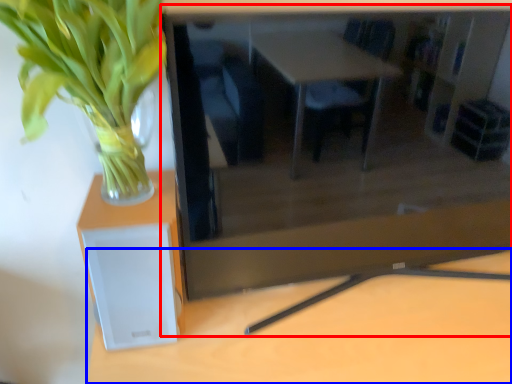
Question: Among these objects, which one is farthest to the camera, computer desk (highlighted by a red box) or table (highlighted by a blue box)?

Choices:
 (A) computer desk
 (B) table

Answer: (B)